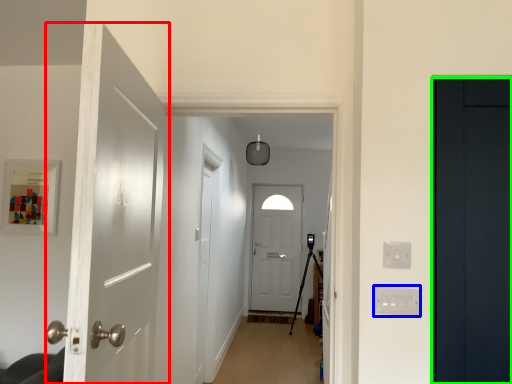
Question: Which is nearer to the door (highlighted by a red box)? electric outlet (highlighted by a blue box) or door (highlighted by a green box).

Choices:
 (A) electric outlet
 (B) door

Answer: (A)